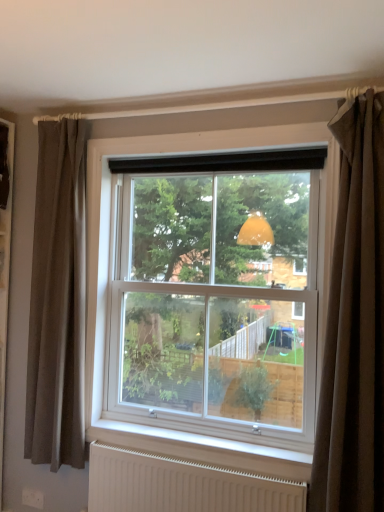
Question: Is white matte radiator at lower center facing away from white plastic window at center?

Choices:
 (A) no
 (B) yes

Answer: (A)

Question: Considering the relative positions of white matte radiator at lower center and white plastic window at center in the image provided, is white matte radiator at lower center to the left of white plastic window at center from the viewer's perspective?

Choices:
 (A) no
 (B) yes

Answer: (B)

Question: Considering the relative sizes of white matte radiator at lower center and white plastic window at center in the image provided, is white matte radiator at lower center smaller than white plastic window at center?

Choices:
 (A) yes
 (B) no

Answer: (A)

Question: Considering the relative positions of white matte radiator at lower center and white plastic window at center in the image provided, is white matte radiator at lower center to the right of white plastic window at center from the viewer's perspective?

Choices:
 (A) yes
 (B) no

Answer: (B)

Question: Is white plastic window at center completely or partially inside white matte radiator at lower center?

Choices:
 (A) yes
 (B) no

Answer: (B)

Question: Based on their sizes in the image, would you say brown fabric curtain at right, which is the first curtain from right to left, is bigger or smaller than brown fabric curtain at left, which ranks as the first curtain in back-to-front order?

Choices:
 (A) small
 (B) big

Answer: (A)

Question: In terms of width, does brown fabric curtain at right, which is the first curtain from right to left, look wider or thinner when compared to brown fabric curtain at left, acting as the first curtain starting from the left?

Choices:
 (A) thin
 (B) wide

Answer: (B)

Question: In terms of height, does brown fabric curtain at right, arranged as the first curtain when viewed from the front, look taller or shorter compared to brown fabric curtain at left, which ranks as the 2th curtain in right-to-left order?

Choices:
 (A) tall
 (B) short

Answer: (B)

Question: Does point (327, 348) appear closer or farther from the camera than point (61, 437)?

Choices:
 (A) farther
 (B) closer

Answer: (B)

Question: In the image, is brown fabric curtain at left, which ranks as the 2th curtain in right-to-left order, positioned in front of or behind brown fabric curtain at right, arranged as the first curtain when viewed from the front?

Choices:
 (A) front
 (B) behind

Answer: (B)

Question: Does point (77, 415) appear closer or farther from the camera than point (377, 399)?

Choices:
 (A) farther
 (B) closer

Answer: (A)

Question: In the image, is brown fabric curtain at left, which ranks as the 2th curtain in right-to-left order, on the left side or the right side of brown fabric curtain at right, arranged as the first curtain when viewed from the front?

Choices:
 (A) left
 (B) right

Answer: (A)

Question: From a real-world perspective, is brown fabric curtain at left, which ranks as the second curtain in front-to-back order, physically located above or below brown fabric curtain at right, positioned as the second curtain in back-to-front order?

Choices:
 (A) above
 (B) below

Answer: (B)

Question: In the image, is brown fabric curtain at right, the second curtain from the left, positioned in front of or behind white matte radiator at lower center?

Choices:
 (A) behind
 (B) front

Answer: (B)

Question: Is brown fabric curtain at right, positioned as the second curtain in back-to-front order, wider or thinner than white matte radiator at lower center?

Choices:
 (A) thin
 (B) wide

Answer: (B)